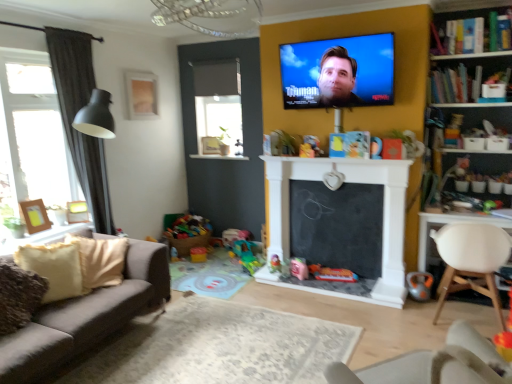
Where is `free location above beige carpet at center (from a real-world perspective)`? The width and height of the screenshot is (512, 384). free location above beige carpet at center (from a real-world perspective) is located at coordinates (202, 348).